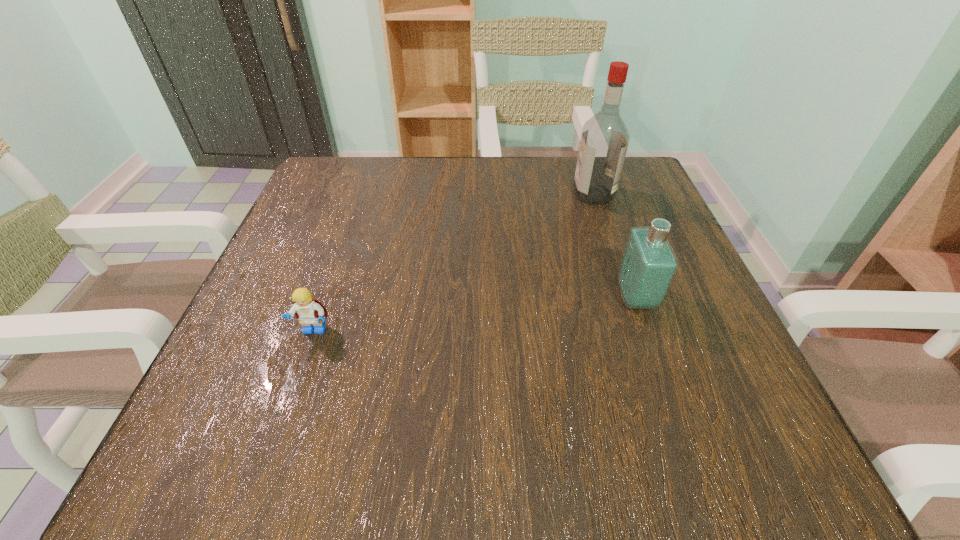
You are a GUI agent. You are given a task and a screenshot of the screen. Output one action in this format:
    pyautogui.click(x=<x>, y=<y>)
    Task: Click on the vacant space situated on the front label of the perfume
    
    Given the screenshot: What is the action you would take?
    pyautogui.click(x=579, y=298)

The width and height of the screenshot is (960, 540). In order to click on free location located 0.100m on the front-facing side of the Lego in this screenshot , I will do `click(291, 400)`.

Locate an element on the screen. This screenshot has height=540, width=960. object positioned at the far edge is located at coordinates (604, 141).

Locate an element on the screen. The width and height of the screenshot is (960, 540). object at the left edge is located at coordinates (310, 311).

This screenshot has width=960, height=540. In order to click on liquor positioned at the right edge in this screenshot , I will do `click(604, 141)`.

This screenshot has width=960, height=540. Identify the location of perfume at the right edge. (648, 266).

Where is `object that is at the far right corner`? object that is at the far right corner is located at coordinates (604, 141).

Locate an element on the screen. vacant space at the far edge is located at coordinates (429, 205).

In the image, there is a desktop. Identify the location of blank space at the near edge. Image resolution: width=960 pixels, height=540 pixels. (311, 418).

Find the location of a particular element. The height and width of the screenshot is (540, 960). free space at the left edge is located at coordinates (260, 323).